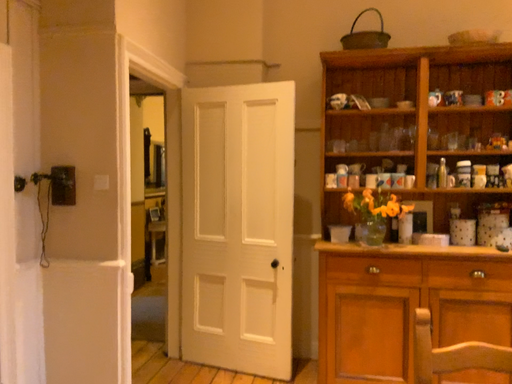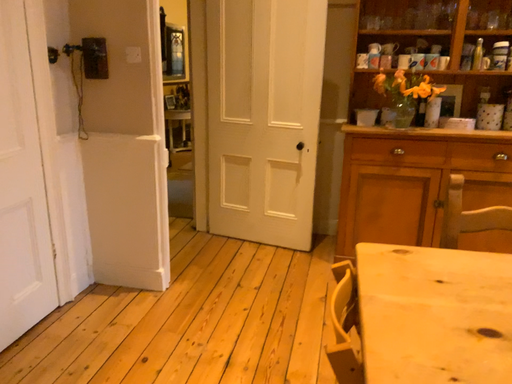
Question: How did the camera likely rotate when shooting the video?

Choices:
 (A) rotated downward
 (B) rotated upward

Answer: (A)